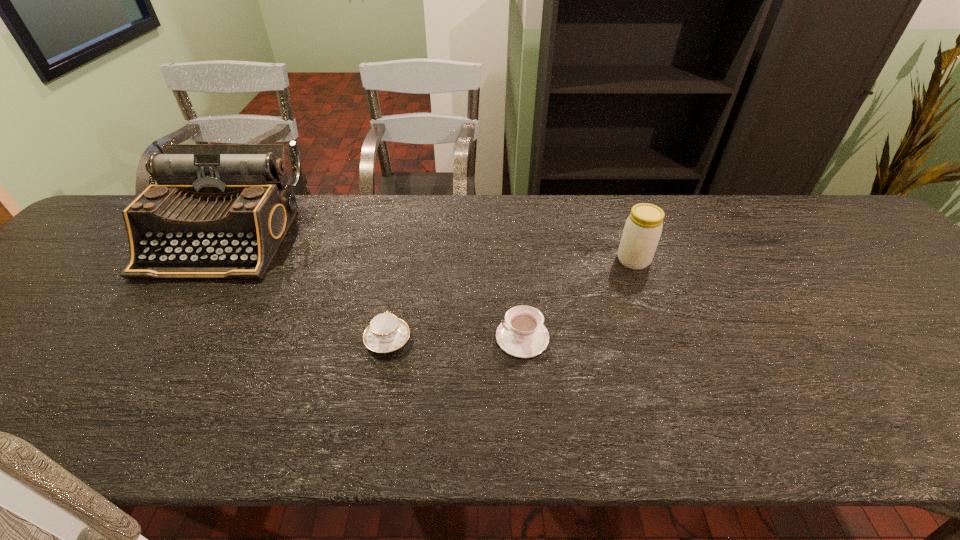
Where is `vacant space located on the handle side of the third object from left to right`? This screenshot has width=960, height=540. vacant space located on the handle side of the third object from left to right is located at coordinates (316, 337).

Locate an element on the screen. This screenshot has width=960, height=540. free spot located on the handle side of the third object from left to right is located at coordinates (316, 337).

Identify the location of vacant space located 0.330m on the side with the handle of the second object from left to right. Image resolution: width=960 pixels, height=540 pixels. (408, 234).

Locate an element on the screen. The width and height of the screenshot is (960, 540). vacant space located on the side with the handle of the second object from left to right is located at coordinates (402, 262).

The width and height of the screenshot is (960, 540). I want to click on vacant space located 0.180m on the side with the handle of the second object from left to right, so click(401, 269).

This screenshot has width=960, height=540. What are the coordinates of `object present at the far edge` in the screenshot? It's located at (218, 211).

Locate an element on the screen. The image size is (960, 540). vacant space at the far edge of the desktop is located at coordinates (429, 218).

The width and height of the screenshot is (960, 540). In the image, there is a desktop. In order to click on vacant space at the near edge in this screenshot , I will do `click(320, 428)`.

Identify the location of free space between the shorter teacup and the typewriter. (306, 288).

The image size is (960, 540). Identify the location of free space between the third object from left to right and the typewriter. (373, 287).